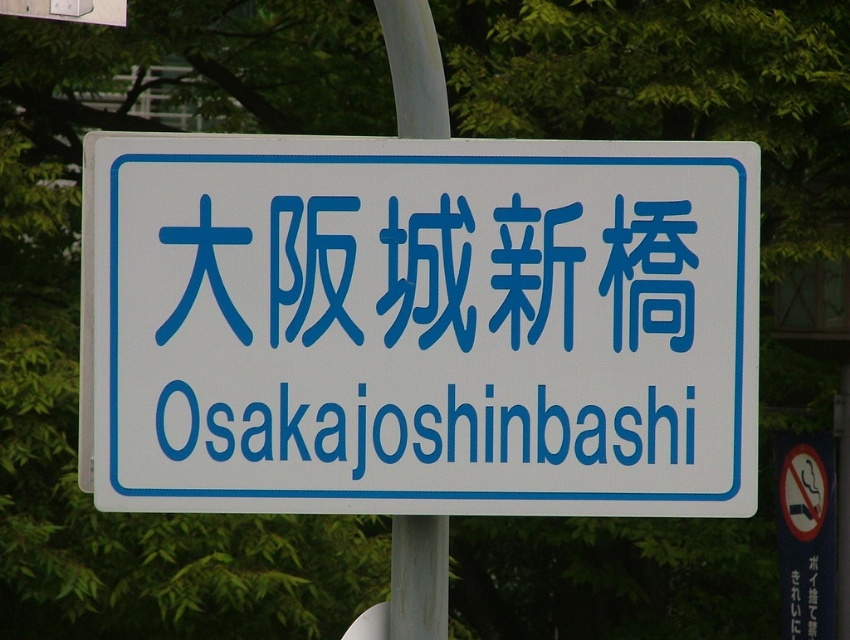
Between bluematerial/texturetext at center and metallic gray pole at center, which one appears on the right side from the viewer's perspective?

bluematerial/texturetext at center

Based on the photo, who is lower down, bluematerial/texturetext at center or metallic gray pole at center?

metallic gray pole at center is lower down.

Locate an element on the screen. This screenshot has height=640, width=850. bluematerial/texturetext at center is located at coordinates (422, 432).

Who is shorter, white plastic signboard at center or bluematerial/texturetext at center?

bluematerial/texturetext at center

Which is below, white plastic signboard at center or bluematerial/texturetext at center?

bluematerial/texturetext at center is lower down.

Who is more distant from viewer, (718, 180) or (523, 458)?

The point (718, 180) is more distant.

You are a GUI agent. You are given a task and a screenshot of the screen. Output one action in this format:
    pyautogui.click(x=<x>, y=<y>)
    Task: Click on the white plastic signboard at center
    
    Given the screenshot: What is the action you would take?
    pyautogui.click(x=422, y=326)

Does metallic gray pole at center appear on the left side of blue plastic sign at center?

Indeed, metallic gray pole at center is positioned on the left side of blue plastic sign at center.

The image size is (850, 640). Describe the element at coordinates (416, 579) in the screenshot. I see `metallic gray pole at center` at that location.

Locate an element on the screen. Image resolution: width=850 pixels, height=640 pixels. metallic gray pole at center is located at coordinates (416, 579).